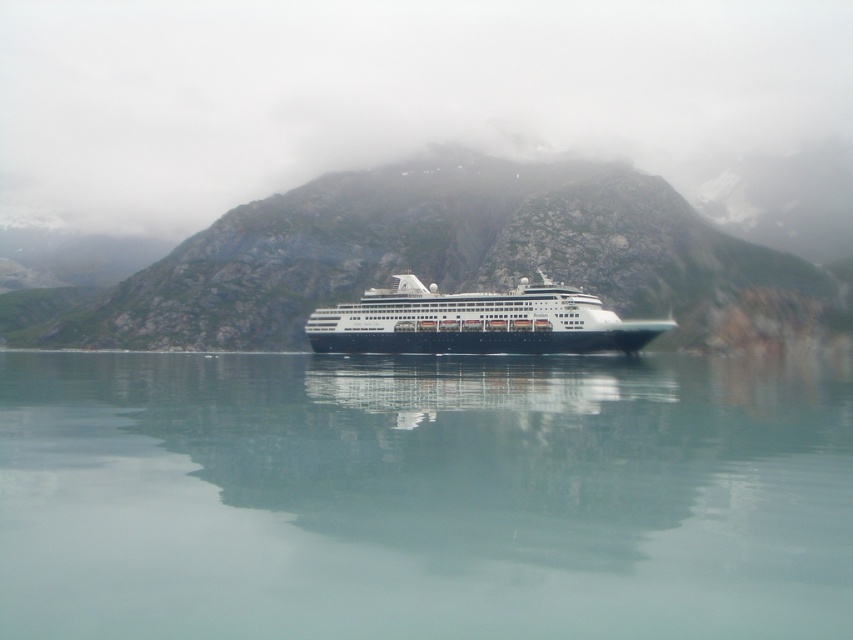
Is clear water at center bigger than rocky mountain at center?

Incorrect, clear water at center is not larger than rocky mountain at center.

Does clear water at center appear under rocky mountain at center?

Yes, clear water at center is below rocky mountain at center.

Does point (607, 493) come farther from viewer compared to point (671, 218)?

No, (607, 493) is closer to viewer.

You are a GUI agent. You are given a task and a screenshot of the screen. Output one action in this format:
    pyautogui.click(x=<x>, y=<y>)
    Task: Click on the clear water at center
    The height and width of the screenshot is (640, 853).
    Given the screenshot: What is the action you would take?
    pyautogui.click(x=422, y=497)

Who is lower down, clear water at center or shiny black cruise ship at center?

clear water at center

Is clear water at center wider than shiny black cruise ship at center?

Correct, the width of clear water at center exceeds that of shiny black cruise ship at center.

Does point (821, 552) lie in front of point (589, 308)?

That is True.

Where is `clear water at center`? Image resolution: width=853 pixels, height=640 pixels. clear water at center is located at coordinates (422, 497).

What do you see at coordinates (445, 259) in the screenshot? Image resolution: width=853 pixels, height=640 pixels. I see `rocky mountain at center` at bounding box center [445, 259].

Which is in front, point (422, 269) or point (492, 337)?

Point (492, 337) is in front.

Locate an element on the screen. The image size is (853, 640). rocky mountain at center is located at coordinates (445, 259).